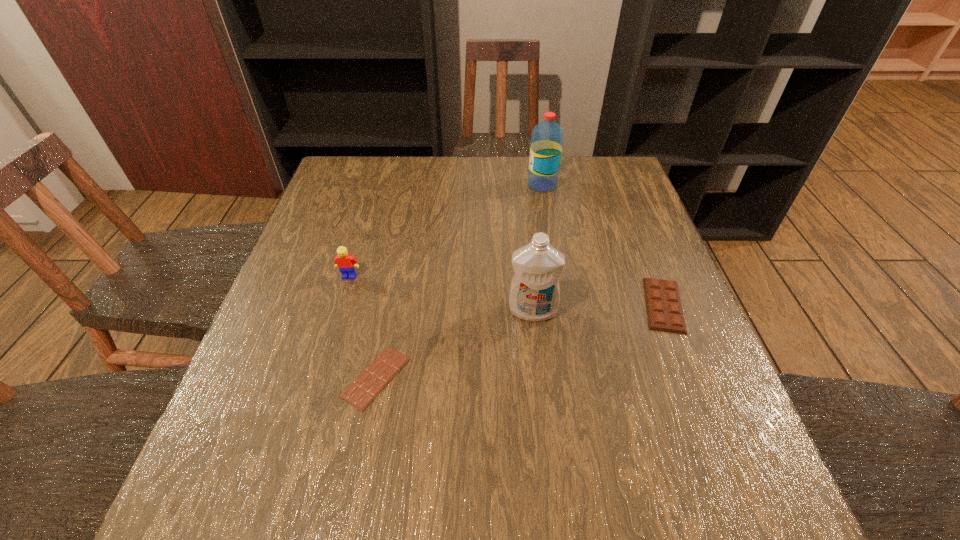
Image resolution: width=960 pixels, height=540 pixels. I want to click on free space at the left edge of the desktop, so click(x=288, y=272).

I want to click on free space at the right edge, so click(x=732, y=435).

Identify the location of vacant space at the far left corner of the desktop. The height and width of the screenshot is (540, 960). (347, 179).

Find the location of a particular element. Image resolution: width=960 pixels, height=540 pixels. free space between the third tallest object and the shorter chocolate bar is located at coordinates (363, 327).

This screenshot has height=540, width=960. What are the coordinates of `vacant space that is in between the leftmost object and the detergent` in the screenshot? It's located at (441, 294).

Where is `empty space that is in between the detergent and the farther chocolate bar`? empty space that is in between the detergent and the farther chocolate bar is located at coordinates (598, 308).

Find the location of a particular element. vacant space that is in between the nearest object and the detergent is located at coordinates (454, 344).

This screenshot has width=960, height=540. Identify the location of vacant point located between the Lego and the detergent. click(441, 294).

Locate an element on the screen. The width and height of the screenshot is (960, 540). free spot between the taller chocolate bar and the farthest object is located at coordinates (603, 245).

Identify the location of empty space between the second object from left to right and the water bottle. (459, 281).